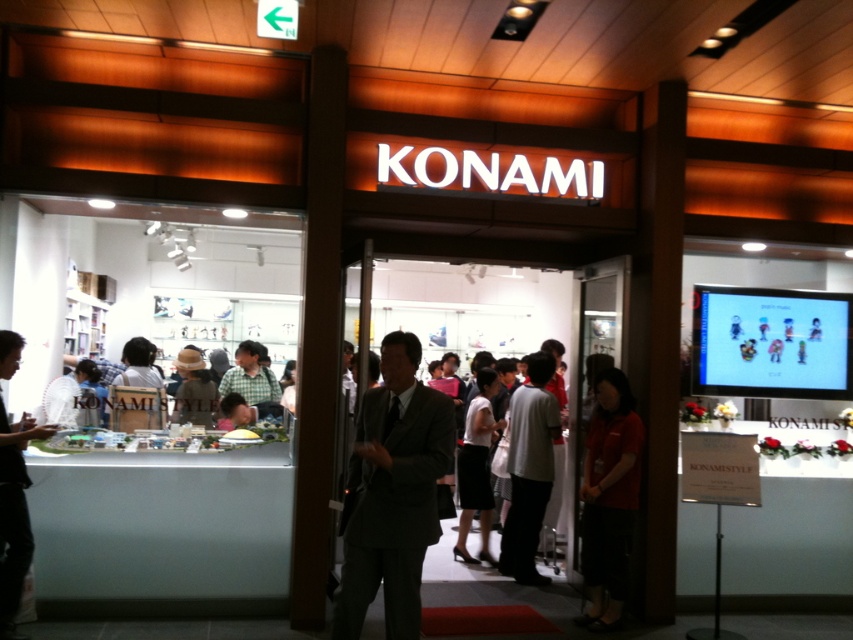
Does red smooth shirt at lower right appear over white fabric skirt at center?

Indeed, red smooth shirt at lower right is positioned over white fabric skirt at center.

Is red smooth shirt at lower right wider than white fabric skirt at center?

In fact, red smooth shirt at lower right might be narrower than white fabric skirt at center.

Is point (618, 435) in front of point (463, 433)?

Yes.

At what (x,y) coordinates should I click in order to perform the action: click on red smooth shirt at lower right. Please return your answer as a coordinate pair (x, y). The height and width of the screenshot is (640, 853). Looking at the image, I should click on (608, 497).

Who is taller, gray suit at center or dark gray suit at left?

dark gray suit at left

Describe the element at coordinates (392, 493) in the screenshot. I see `gray suit at center` at that location.

Identify the location of gray suit at center. The width and height of the screenshot is (853, 640). (392, 493).

Can you confirm if gray fabric shirt at center is thinner than white fabric skirt at center?

Incorrect, gray fabric shirt at center's width is not less than white fabric skirt at center's.

Who is shorter, gray fabric shirt at center or white fabric skirt at center?

white fabric skirt at center is shorter.

This screenshot has width=853, height=640. What do you see at coordinates (529, 468) in the screenshot? I see `gray fabric shirt at center` at bounding box center [529, 468].

Identify the location of gray fabric shirt at center. The height and width of the screenshot is (640, 853). (529, 468).